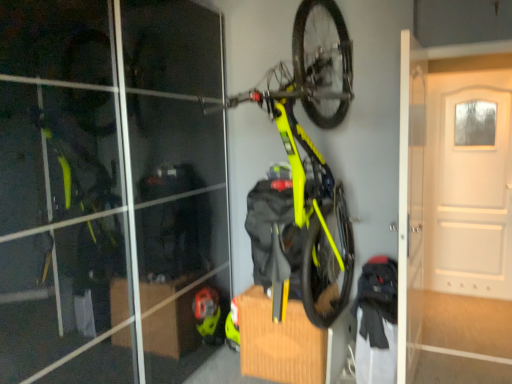
Question: Should I look upward or downward to see neon yellow matte bicycle at upper center?

Choices:
 (A) up
 (B) down

Answer: (A)

Question: Is neon yellow matte bicycle at upper center taller than white matte door at upper right?

Choices:
 (A) no
 (B) yes

Answer: (A)

Question: From the image's perspective, would you say neon yellow matte bicycle at upper center is shown under white matte door at upper right?

Choices:
 (A) no
 (B) yes

Answer: (A)

Question: Does neon yellow matte bicycle at upper center appear on the left side of white matte door at upper right?

Choices:
 (A) no
 (B) yes

Answer: (B)

Question: Can you confirm if neon yellow matte bicycle at upper center is bigger than white matte door at upper right?

Choices:
 (A) yes
 (B) no

Answer: (A)

Question: Would you say neon yellow matte bicycle at upper center contains white matte door at upper right?

Choices:
 (A) no
 (B) yes

Answer: (A)

Question: Is neon yellow matte bicycle at upper center positioned far away from white matte door at upper right?

Choices:
 (A) yes
 (B) no

Answer: (A)

Question: From a real-world perspective, does white matte door at upper right sit lower than neon yellow matte bicycle at upper center?

Choices:
 (A) no
 (B) yes

Answer: (B)

Question: From a real-world perspective, is white matte door at upper right on neon yellow matte bicycle at upper center?

Choices:
 (A) no
 (B) yes

Answer: (A)

Question: From the image's perspective, would you say white matte door at upper right is positioned over neon yellow matte bicycle at upper center?

Choices:
 (A) no
 (B) yes

Answer: (A)

Question: Does white matte door at upper right lie in front of neon yellow matte bicycle at upper center?

Choices:
 (A) no
 (B) yes

Answer: (A)

Question: Does white matte door at upper right have a larger size compared to neon yellow matte bicycle at upper center?

Choices:
 (A) yes
 (B) no

Answer: (B)

Question: Is white matte door at upper right smaller than neon yellow matte bicycle at upper center?

Choices:
 (A) no
 (B) yes

Answer: (B)

Question: In the image, is white matte door at upper right positioned in front of or behind neon yellow matte bicycle at upper center?

Choices:
 (A) front
 (B) behind

Answer: (B)